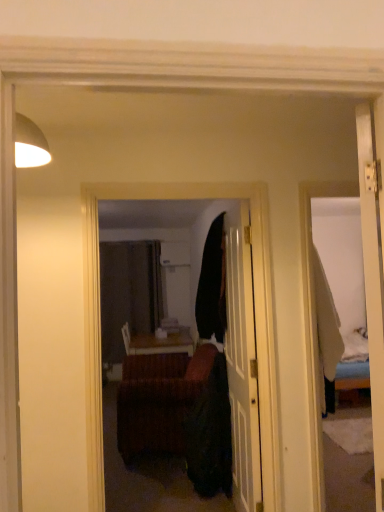
Question: Is brown woven studio couch at center at the right side of matte black mirror at center?

Choices:
 (A) yes
 (B) no

Answer: (B)

Question: Is brown woven studio couch at center next to matte black mirror at center?

Choices:
 (A) no
 (B) yes

Answer: (A)

Question: Is brown woven studio couch at center not inside matte black mirror at center?

Choices:
 (A) no
 (B) yes

Answer: (B)

Question: Considering the relative sizes of brown woven studio couch at center and matte black mirror at center in the image provided, is brown woven studio couch at center smaller than matte black mirror at center?

Choices:
 (A) no
 (B) yes

Answer: (A)

Question: Is brown woven studio couch at center facing away from matte black mirror at center?

Choices:
 (A) yes
 (B) no

Answer: (B)

Question: From their relative heights in the image, would you say woven wood table at center is taller or shorter than matte black mirror at center?

Choices:
 (A) tall
 (B) short

Answer: (B)

Question: Based on their positions, is woven wood table at center located to the left or right of matte black mirror at center?

Choices:
 (A) right
 (B) left

Answer: (B)

Question: From a real-world perspective, is woven wood table at center above or below matte black mirror at center?

Choices:
 (A) below
 (B) above

Answer: (A)

Question: From the image's perspective, is woven wood table at center located above or below matte black mirror at center?

Choices:
 (A) above
 (B) below

Answer: (B)

Question: Considering the positions of point (158, 338) and point (178, 381), is point (158, 338) closer or farther from the camera than point (178, 381)?

Choices:
 (A) farther
 (B) closer

Answer: (A)

Question: Considering their positions, is woven wood table at center located in front of or behind brown woven studio couch at center?

Choices:
 (A) behind
 (B) front

Answer: (A)

Question: From a real-world perspective, is woven wood table at center above or below brown woven studio couch at center?

Choices:
 (A) above
 (B) below

Answer: (A)

Question: From the image's perspective, relative to brown woven studio couch at center, is woven wood table at center above or below?

Choices:
 (A) above
 (B) below

Answer: (B)

Question: Would you say matte black mirror at center is inside or outside woven wood table at center?

Choices:
 (A) outside
 (B) inside

Answer: (A)

Question: From the image's perspective, is matte black mirror at center above or below woven wood table at center?

Choices:
 (A) below
 (B) above

Answer: (B)